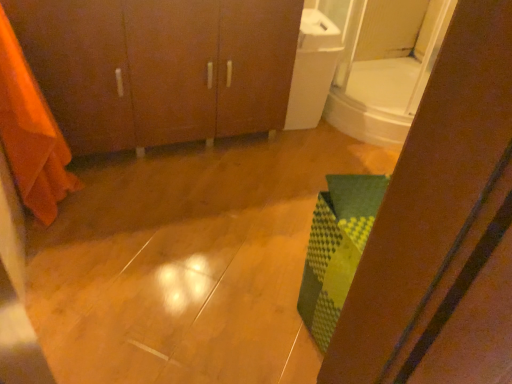
Question: From a real-world perspective, is matte wood cabinet at upper left physically above white glossy mirror at upper right?

Choices:
 (A) no
 (B) yes

Answer: (A)

Question: Could you tell me if matte wood cabinet at upper left is turned towards white glossy mirror at upper right?

Choices:
 (A) no
 (B) yes

Answer: (A)

Question: Is matte wood cabinet at upper left taller than white glossy mirror at upper right?

Choices:
 (A) yes
 (B) no

Answer: (A)

Question: Does matte wood cabinet at upper left have a greater width compared to white glossy mirror at upper right?

Choices:
 (A) no
 (B) yes

Answer: (A)

Question: From a real-world perspective, is matte wood cabinet at upper left under white glossy mirror at upper right?

Choices:
 (A) no
 (B) yes

Answer: (B)

Question: In terms of width, does orange fabric at left look wider or thinner when compared to white glossy mirror at upper right?

Choices:
 (A) wide
 (B) thin

Answer: (B)

Question: Is orange fabric at left taller or shorter than white glossy mirror at upper right?

Choices:
 (A) short
 (B) tall

Answer: (B)

Question: From the image's perspective, relative to white glossy mirror at upper right, is orange fabric at left above or below?

Choices:
 (A) below
 (B) above

Answer: (A)

Question: Considering the positions of point [x=33, y=183] and point [x=344, y=124], is point [x=33, y=183] closer or farther from the camera than point [x=344, y=124]?

Choices:
 (A) closer
 (B) farther

Answer: (A)

Question: Which is correct: white glossy mirror at upper right is inside matte wood cabinet at upper left, or outside of it?

Choices:
 (A) inside
 (B) outside

Answer: (B)

Question: Relative to matte wood cabinet at upper left, is white glossy mirror at upper right in front or behind?

Choices:
 (A) behind
 (B) front

Answer: (A)

Question: From a real-world perspective, is white glossy mirror at upper right positioned above or below matte wood cabinet at upper left?

Choices:
 (A) below
 (B) above

Answer: (B)

Question: Is white glossy mirror at upper right taller or shorter than matte wood cabinet at upper left?

Choices:
 (A) short
 (B) tall

Answer: (A)

Question: In the image, is orange fabric at left positioned in front of or behind matte wood cabinet at upper left?

Choices:
 (A) behind
 (B) front

Answer: (B)

Question: From the image's perspective, is orange fabric at left positioned above or below matte wood cabinet at upper left?

Choices:
 (A) below
 (B) above

Answer: (A)